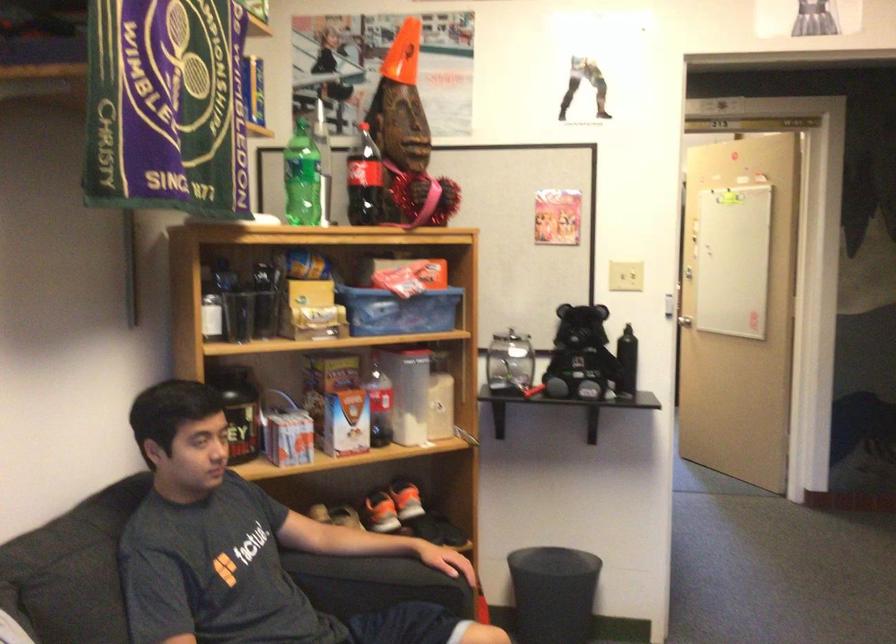
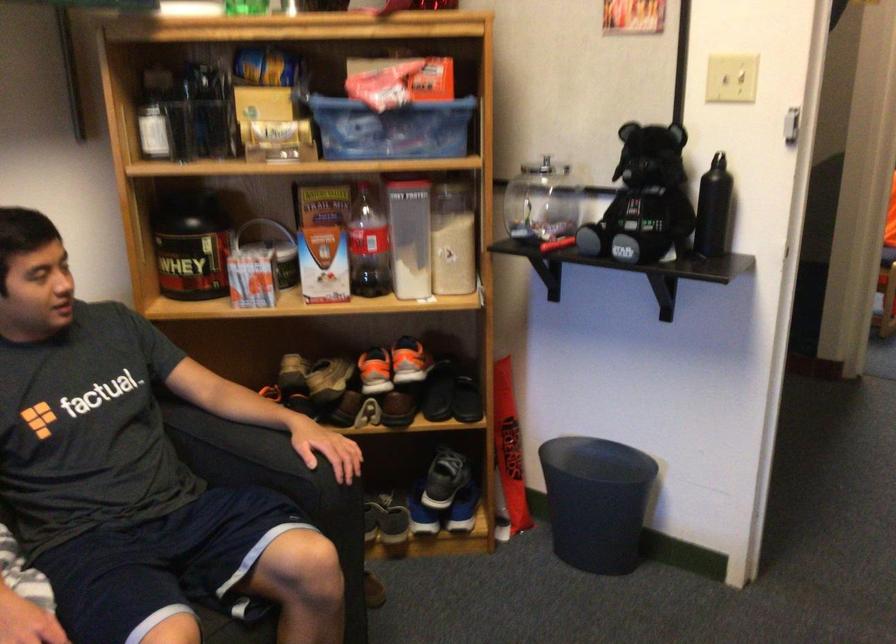
Where in the second image is the point corresponding to (x=590, y=355) from the first image?

(643, 200)